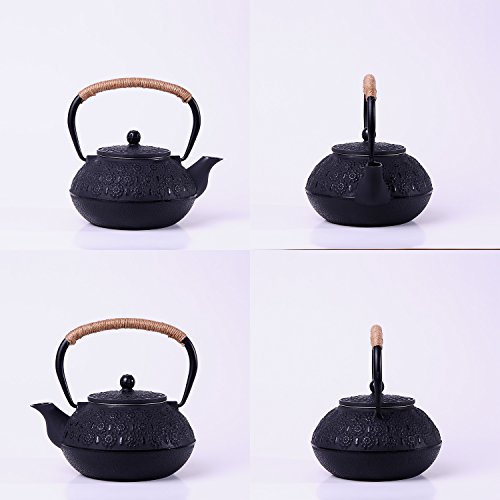
Locate an element on the screen. The height and width of the screenshot is (500, 500). the top of kettle before taking off lid is located at coordinates (349, 151), (152, 402), (362, 406), (161, 156).